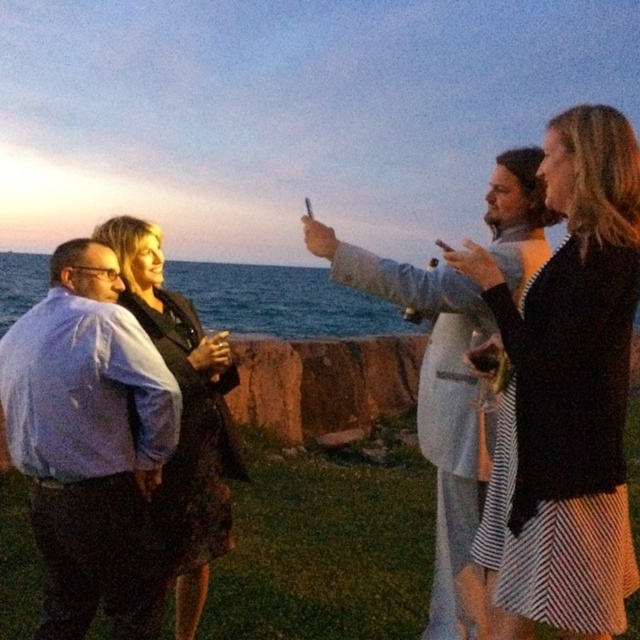
You are trying to find the light blue shirt at left in a group photo. Where should you look relative to the black textured dress at center?

The light blue shirt at left is located to the left of the black textured dress at center.

You are a photographer trying to capture a group photo of the two women in black dresses. The women are wearing a black textured dress at center and a black lace dress at center. Given that your camera has a maximum focus range of 2.5 meters, will both women be in focus?

The black textured dress at center and black lace dress at center are 2.66 meters apart, which exceeds the camera maximum focus range of 2.5 meters. Therefore, both women cannot be in focus simultaneously.